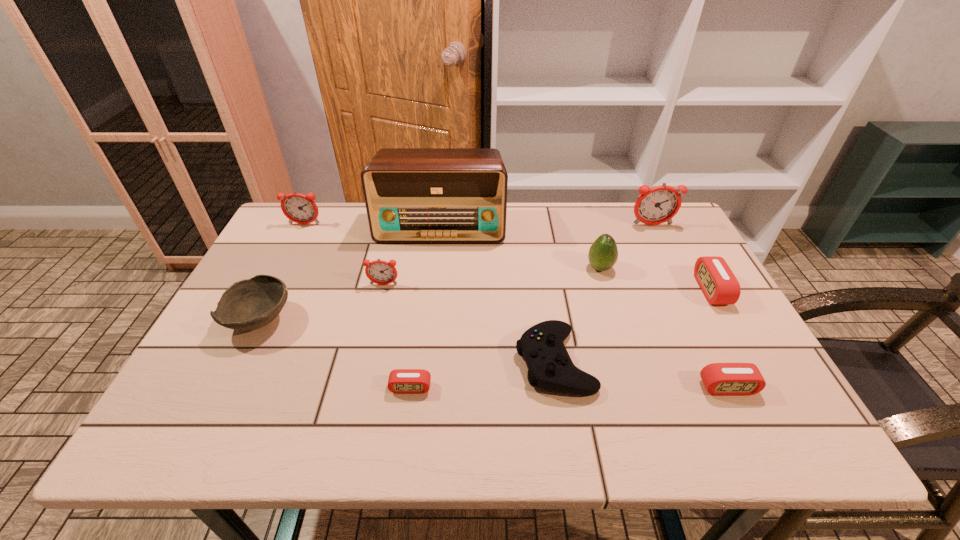
Find the location of a particular element. vacant space located on the front-facing side of the smallest reddish-pink alarm clock is located at coordinates (371, 342).

The image size is (960, 540). In order to click on vacant area situated on the right of the bowl in this screenshot , I will do `click(414, 320)`.

Find the location of a particular element. The height and width of the screenshot is (540, 960). free location located 0.340m on the front-facing side of the fourth tallest alarm clock is located at coordinates (574, 290).

Where is `free space located 0.290m on the front-facing side of the fourth tallest alarm clock`? The width and height of the screenshot is (960, 540). free space located 0.290m on the front-facing side of the fourth tallest alarm clock is located at coordinates (592, 290).

At what (x,y) coordinates should I click in order to perform the action: click on vacant point located 0.300m on the front-facing side of the fourth tallest alarm clock. Please return your answer as a coordinate pair (x, y). Looking at the image, I should click on (589, 290).

In order to click on vacant area situated 0.270m on the right of the sixth object from left to right in this screenshot , I will do `click(710, 361)`.

The image size is (960, 540). In order to click on vacant area situated 0.120m on the front-facing side of the fourth alarm clock from right to left in this screenshot , I will do `click(402, 448)`.

At what (x,y) coordinates should I click in order to perform the action: click on radio receiver present at the far edge. Please return your answer as a coordinate pair (x, y). The height and width of the screenshot is (540, 960). Looking at the image, I should click on (412, 195).

Locate an element on the screen. The image size is (960, 540). alarm clock located in the left edge section of the desktop is located at coordinates (298, 208).

Locate an element on the screen. This screenshot has width=960, height=540. bowl present at the left edge is located at coordinates (249, 304).